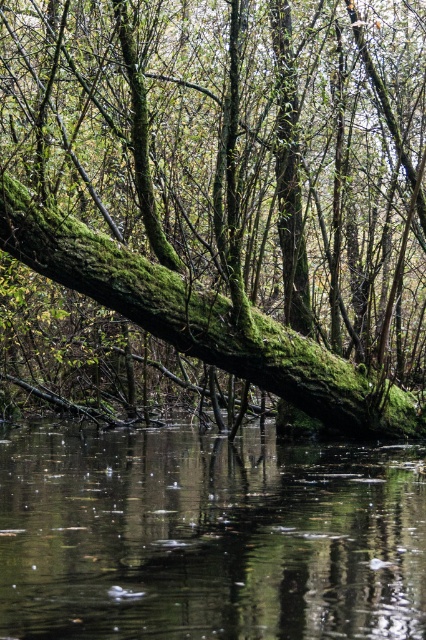
Question: Does green mossy log at center have a greater width compared to transparent water at center?

Choices:
 (A) yes
 (B) no

Answer: (A)

Question: Which point is farther to the camera?

Choices:
 (A) green mossy log at center
 (B) transparent water at center

Answer: (A)

Question: Does green mossy log at center appear on the left side of transparent water at center?

Choices:
 (A) no
 (B) yes

Answer: (B)

Question: Which object appears farthest from the camera in this image?

Choices:
 (A) green mossy log at center
 (B) transparent water at center

Answer: (A)

Question: Observing the image, what is the correct spatial positioning of green mossy log at center in reference to transparent water at center?

Choices:
 (A) left
 (B) right

Answer: (A)